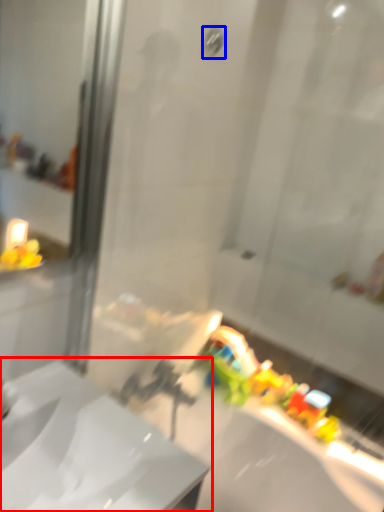
Question: Which of the following is the closest to the observer, sink (highlighted by a red box) or shower (highlighted by a blue box)?

Choices:
 (A) sink
 (B) shower

Answer: (A)